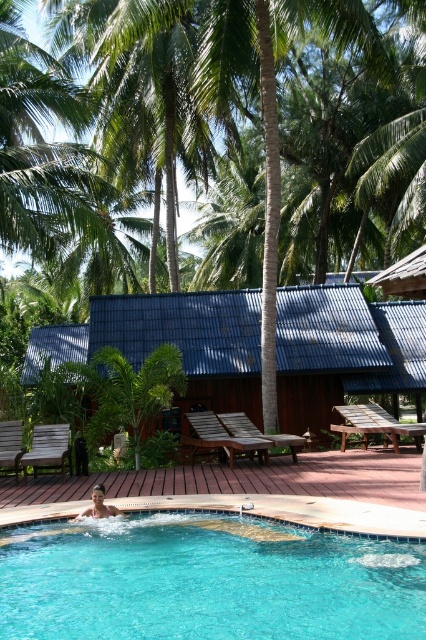
Question: Can you confirm if blue glassy swimming pool at lower left is bigger than wooden hut at center?

Choices:
 (A) no
 (B) yes

Answer: (A)

Question: Where is blue glassy swimming pool at lower left located in relation to wooden hut at center in the image?

Choices:
 (A) right
 (B) left

Answer: (A)

Question: Among these points, which one is nearest to the camera?

Choices:
 (A) (149, 595)
 (B) (31, 339)

Answer: (A)

Question: Which of the following is the farthest from the observer?

Choices:
 (A) (221, 349)
 (B) (397, 576)

Answer: (A)

Question: Among these objects, which one is farthest from the camera?

Choices:
 (A) blue glassy swimming pool at lower left
 (B) wooden hut at center

Answer: (B)

Question: Can you confirm if blue glassy swimming pool at lower left is positioned to the right of wooden hut at center?

Choices:
 (A) yes
 (B) no

Answer: (A)